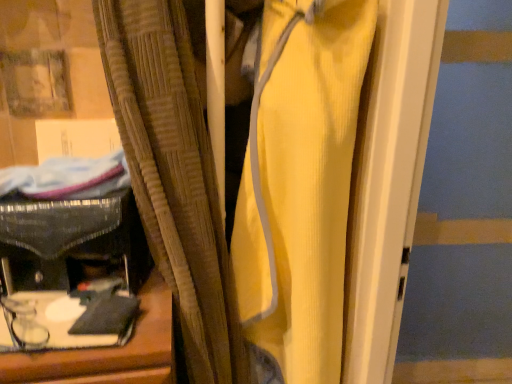
The image size is (512, 384). Find the location of `yellow ribbed fabric curtain at center`. yellow ribbed fabric curtain at center is located at coordinates (248, 183).

This screenshot has width=512, height=384. What do you see at coordinates (248, 183) in the screenshot?
I see `yellow ribbed fabric curtain at center` at bounding box center [248, 183].

The height and width of the screenshot is (384, 512). What are the coordinates of `yellow ribbed fabric curtain at center` in the screenshot? It's located at (248, 183).